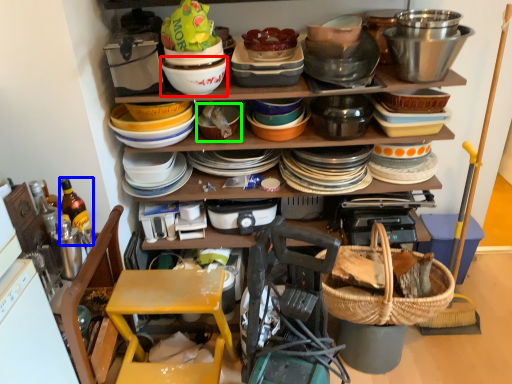
Question: Estimate the real-world distances between objects in this image. Which object is closer to bowl (highlighted by a red box), bottle (highlighted by a blue box) or basket (highlighted by a green box)?

Choices:
 (A) bottle
 (B) basket

Answer: (B)